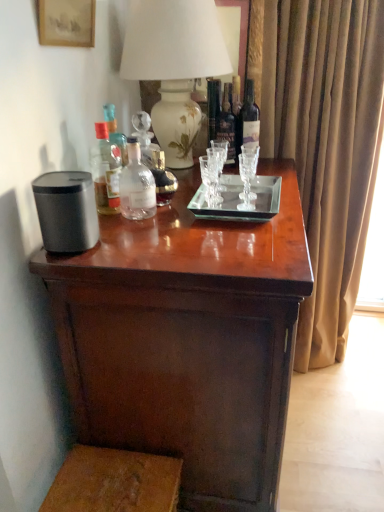
Locate an element on the screen. The width and height of the screenshot is (384, 512). empty space that is ontop of wooden step stool at lower left (from a real-world perspective) is located at coordinates (113, 480).